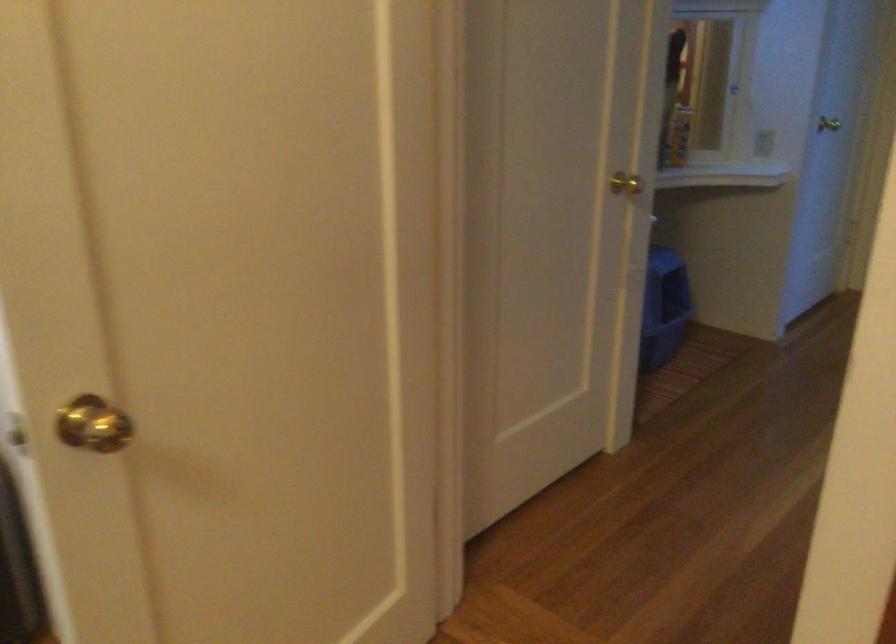
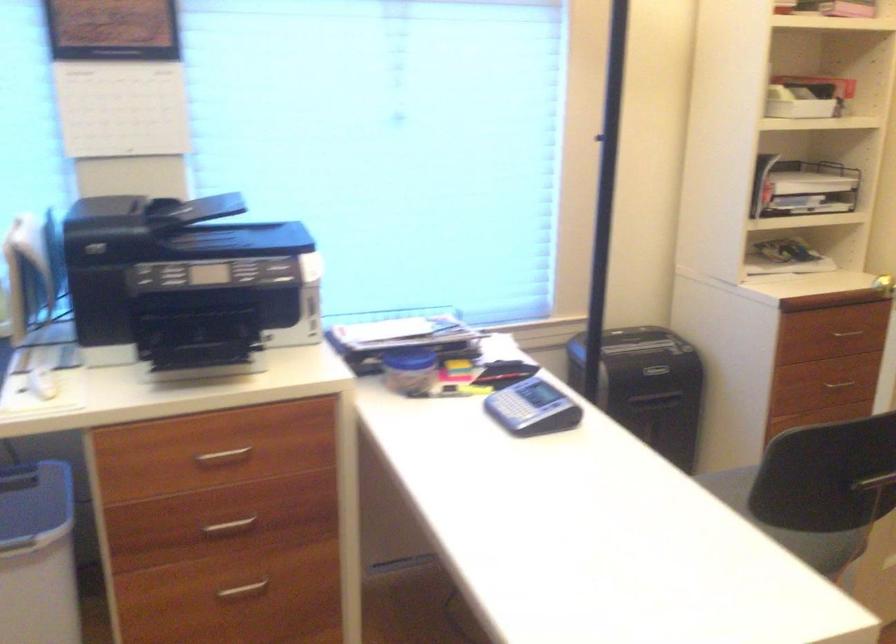
In a continuous first-person perspective shot, in which direction is the camera moving?

The cameraman moved toward left, backward.